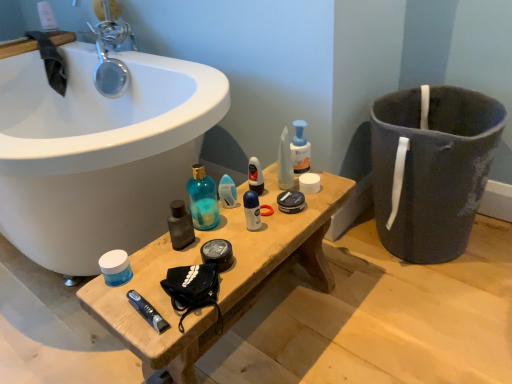
The image size is (512, 384). I want to click on free space in front of white matte deodorant at center, the 2th toiletry in the right-to-left sequence, so click(x=249, y=252).